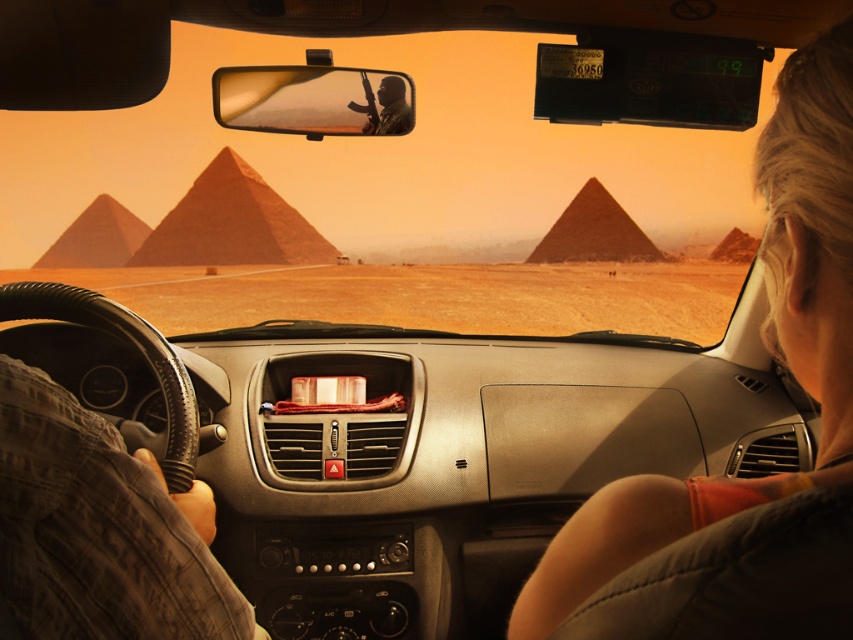
From the picture: Who is more distant from viewer, (x=816, y=204) or (x=312, y=307)?

Positioned behind is point (x=312, y=307).

In order to click on gray fabric sleeve at lower left in this screenshot , I will do `click(762, 337)`.

Is brown textured shirt at lower left wider than reddish sandstone pyramid at center?

Incorrect, brown textured shirt at lower left's width does not surpass reddish sandstone pyramid at center's.

Who is higher up, brown textured shirt at lower left or reddish sandstone pyramid at center?

reddish sandstone pyramid at center is higher up.

The width and height of the screenshot is (853, 640). What do you see at coordinates (99, 531) in the screenshot?
I see `brown textured shirt at lower left` at bounding box center [99, 531].

Find the location of a particular element. This screenshot has width=853, height=640. brown textured shirt at lower left is located at coordinates (x=99, y=531).

Can you confirm if desert sand at center is taller than reddish sandstone pyramid at center?

No, desert sand at center is not taller than reddish sandstone pyramid at center.

Looking at this image, who is shorter, desert sand at center or reddish sandstone pyramid at center?

Standing shorter between the two is desert sand at center.

The width and height of the screenshot is (853, 640). What are the coordinates of `desert sand at center` in the screenshot? It's located at (428, 296).